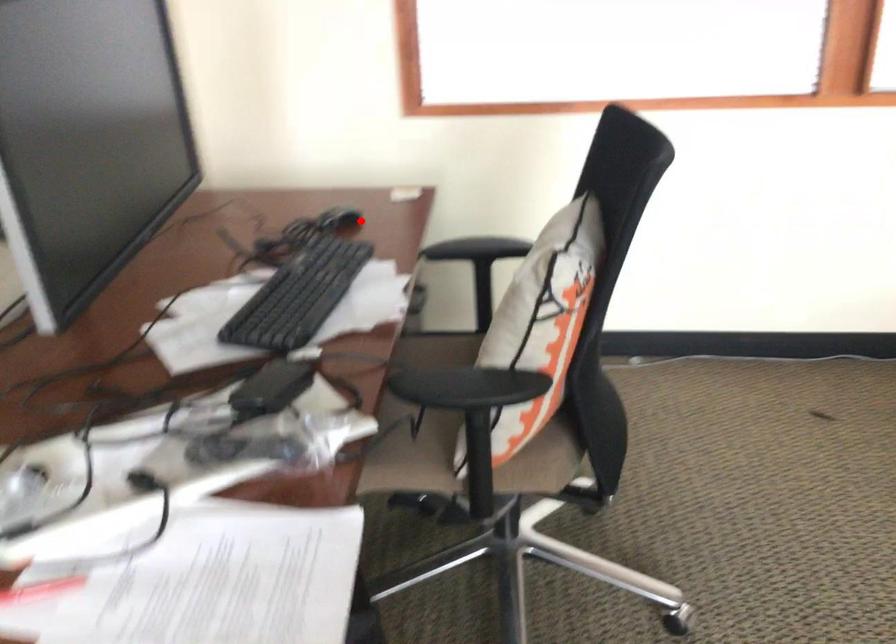
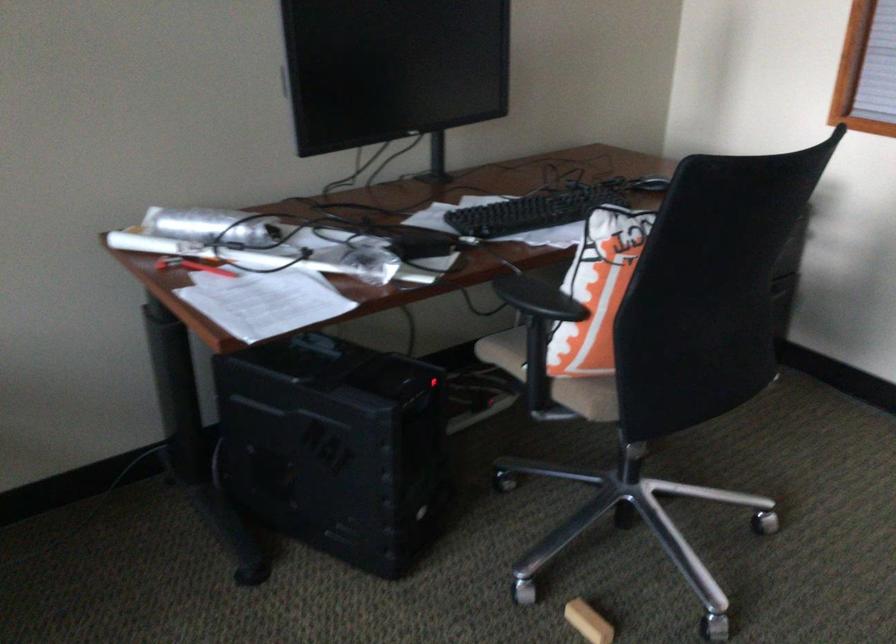
Question: I am providing you with two images of the same scene from different viewpoints. In image1, a red point is highlighted. Considering the same 3D point in image2, which of the following is correct?

Choices:
 (A) It is closer
 (B) It is farther

Answer: (B)